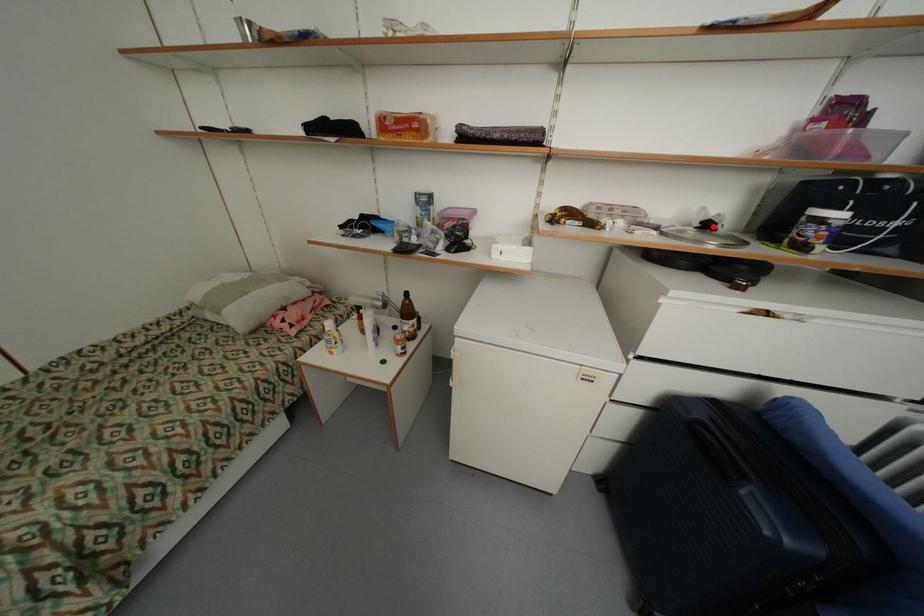
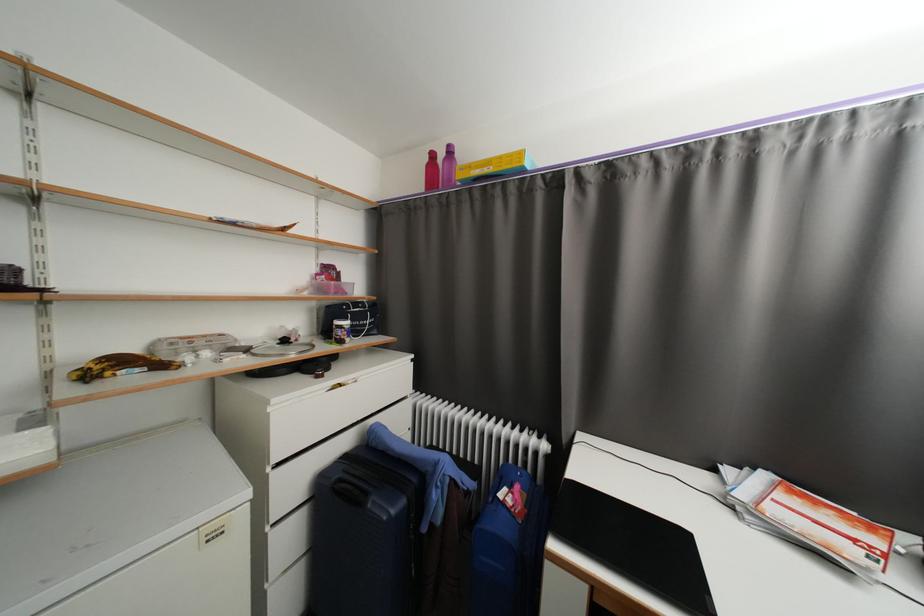
Locate, in the second image, the point that corresponds to the highlighted location in the first image.

(290, 342)